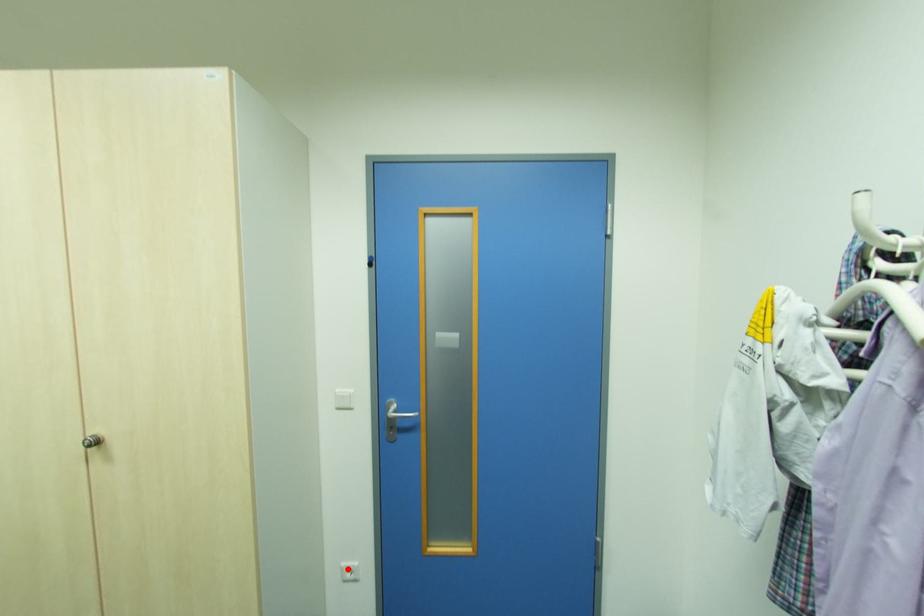
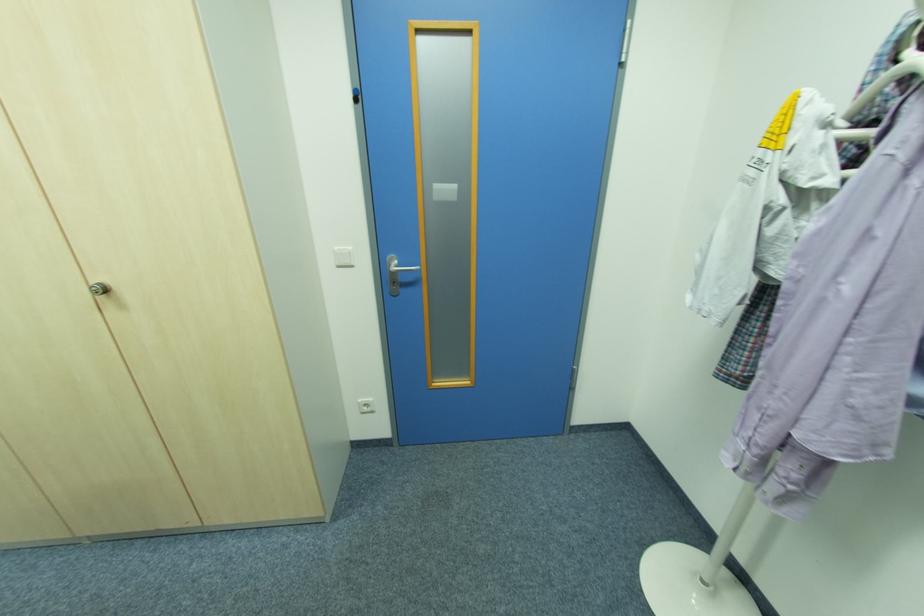
Where in the second image is the point corresponding to the highlighted location from the first image?

(365, 403)